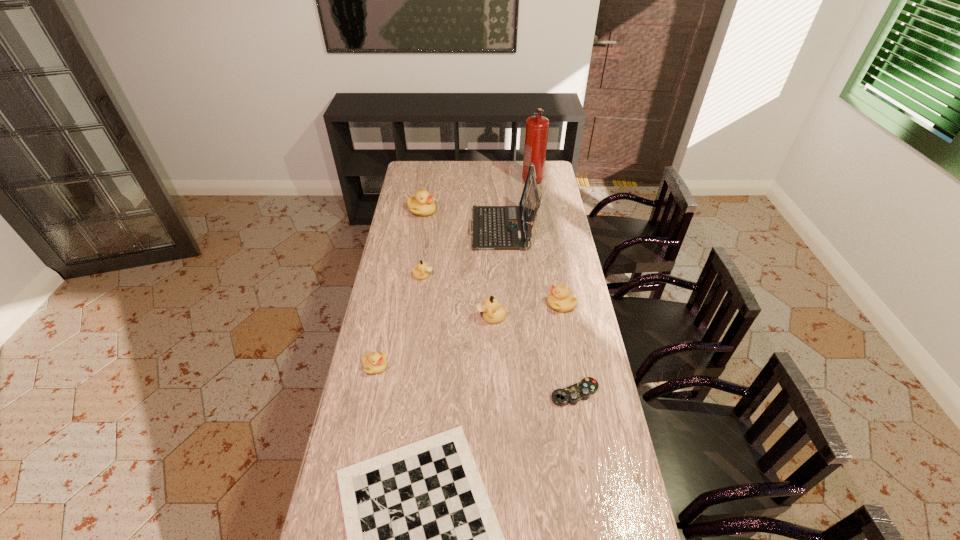
Locate an element on the screen. The width and height of the screenshot is (960, 540). vacant space located on the face of the fourth duckling from left to right is located at coordinates (423, 318).

At what (x,y) coordinates should I click in order to perform the action: click on free spot located on the face of the fourth duckling from left to right. Please return your answer as a coordinate pair (x, y). This screenshot has width=960, height=540. Looking at the image, I should click on (433, 318).

Where is `free space located 0.200m on the face of the fourth duckling from left to right`? This screenshot has width=960, height=540. free space located 0.200m on the face of the fourth duckling from left to right is located at coordinates (425, 318).

I want to click on vacant region located 0.110m on the front-facing side of the rightmost yellow duckling, so click(x=519, y=304).

This screenshot has height=540, width=960. In order to click on vacant region located 0.270m on the front-facing side of the rightmost yellow duckling in this screenshot , I will do `click(480, 304)`.

Find the location of a particular element. free spot located on the front-facing side of the rightmost yellow duckling is located at coordinates (513, 304).

I want to click on free spot located on the face of the left tan duckling, so click(500, 276).

Find the location of `vacant space located on the front-facing side of the seventh tallest object`. vacant space located on the front-facing side of the seventh tallest object is located at coordinates (474, 366).

Where is `vacant area situated 0.390m on the left of the eighth farthest object`? The height and width of the screenshot is (540, 960). vacant area situated 0.390m on the left of the eighth farthest object is located at coordinates 436,393.

This screenshot has width=960, height=540. In order to click on object positioned at the far edge in this screenshot , I will do `click(536, 134)`.